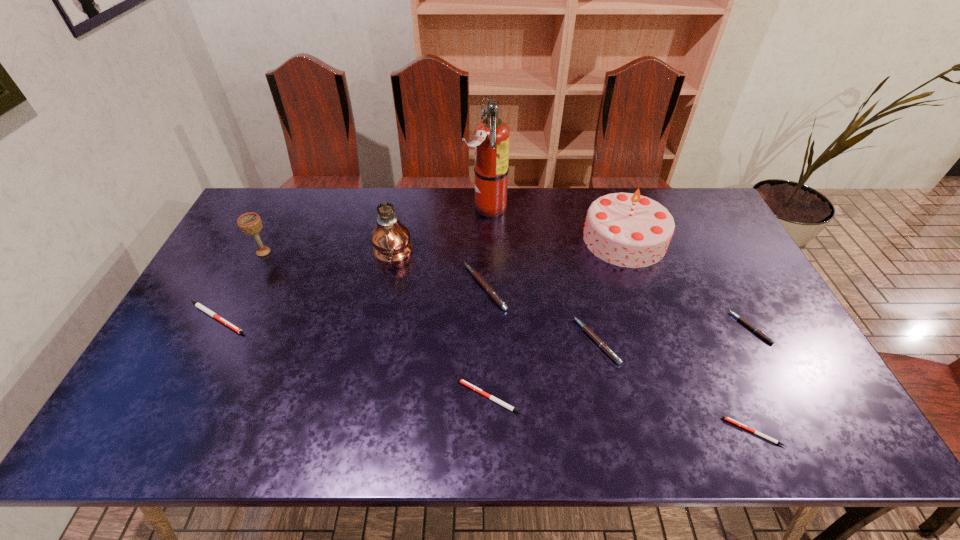
You are a GUI agent. You are given a task and a screenshot of the screen. Output one action in this format:
    pyautogui.click(x=<x>, y=<y>)
    Task: Click on the third closest pen to the chalice
    
    Given the screenshot: What is the action you would take?
    pyautogui.click(x=500, y=402)

You are a GUI agent. You are given a task and a screenshot of the screen. Output one action in this format:
    pyautogui.click(x=<x>, y=<y>)
    Task: Click on the pen that is the third closest to the rightmost object
    The image size is (960, 540).
    Given the screenshot: What is the action you would take?
    pyautogui.click(x=500, y=402)

The image size is (960, 540). What are the coordinates of `pink pen that is the second nearest to the ninth shortest object` in the screenshot? It's located at (584, 327).

Locate an element on the screen. The width and height of the screenshot is (960, 540). pink pen that is the closest one to the seventh shortest object is located at coordinates (489, 290).

Identify which white pen is the second closest to the fifth tallest object. Please provide its 2D coordinates. Your answer should be formatted as a tuple, i.e. [(x, y)], where the tuple contains the x and y coordinates of a point satisfying the conditions above.

[(725, 418)]

Find the location of a particular element. the third closest white pen to the eighth shortest object is located at coordinates 198,305.